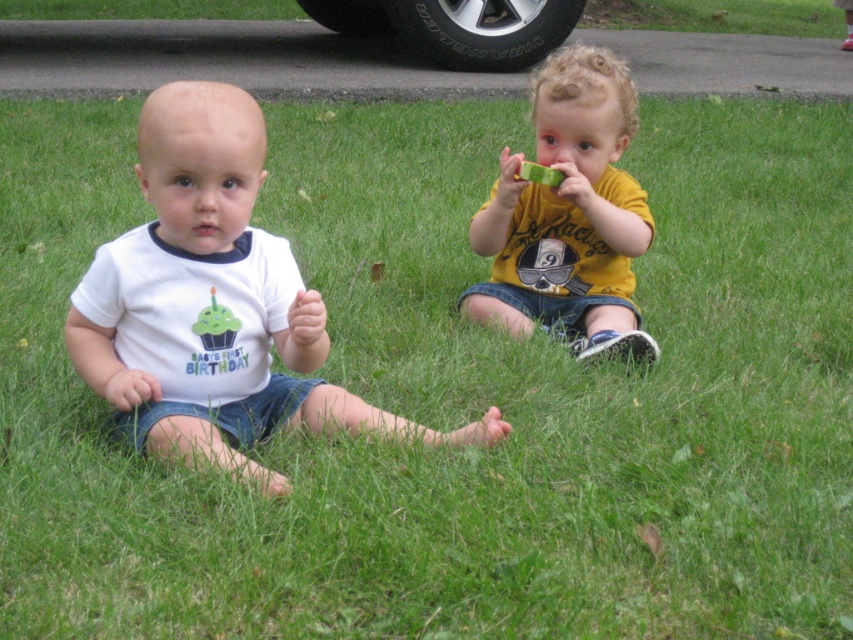
Question: From the image, what is the correct spatial relationship of white cotton shirt at left in relation to yellow matte shirt at center?

Choices:
 (A) left
 (B) right

Answer: (A)

Question: Which object appears farthest from the camera in this image?

Choices:
 (A) yellow matte shirt at center
 (B) white cotton shirt at left

Answer: (A)

Question: Does white cotton shirt at left appear on the left side of yellow matte shirt at center?

Choices:
 (A) yes
 (B) no

Answer: (A)

Question: Is white cotton shirt at left thinner than yellow matte shirt at center?

Choices:
 (A) no
 (B) yes

Answer: (A)